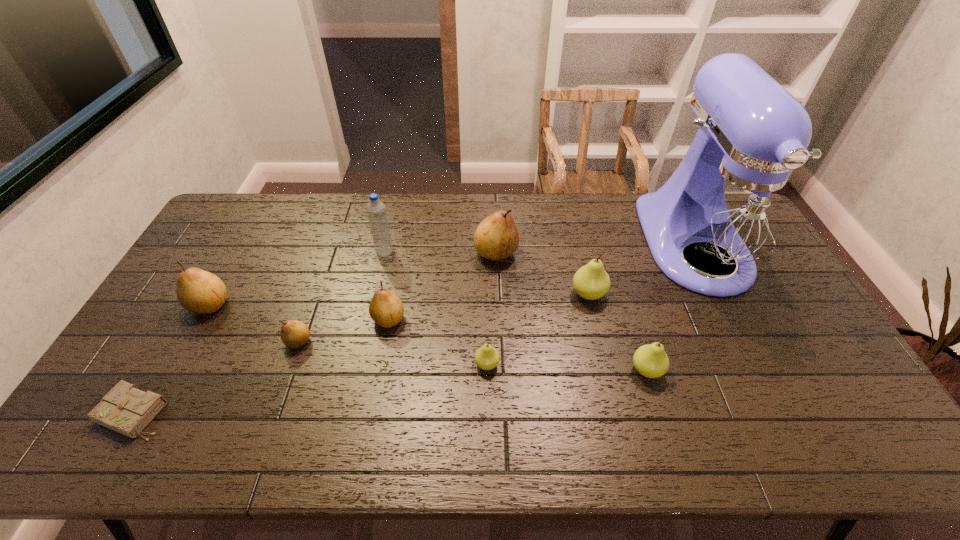
Find the location of `pear positioned at the left edge`. pear positioned at the left edge is located at coordinates (198, 291).

In order to click on diary that is at the left edge in this screenshot , I will do `click(126, 409)`.

This screenshot has width=960, height=540. In order to click on object at the right edge in this screenshot , I will do `click(732, 206)`.

The image size is (960, 540). Identify the location of object situated at the near left corner. (126, 409).

At what (x,y) coordinates should I click in order to perform the action: click on object that is at the far right corner. Please return your answer as a coordinate pair (x, y). The height and width of the screenshot is (540, 960). Looking at the image, I should click on (732, 206).

Identify the location of free space at the far edge. (387, 202).

Locate an element on the screen. The image size is (960, 540). blank space at the near edge is located at coordinates (410, 431).

What are the coordinates of `free spot at the left edge of the desktop` in the screenshot? It's located at (171, 380).

Image resolution: width=960 pixels, height=540 pixels. I want to click on vacant region between the leftmost green pear and the mixer, so click(x=590, y=305).

I want to click on vacant space that's between the leftmost pear and the shortest object, so click(x=172, y=359).